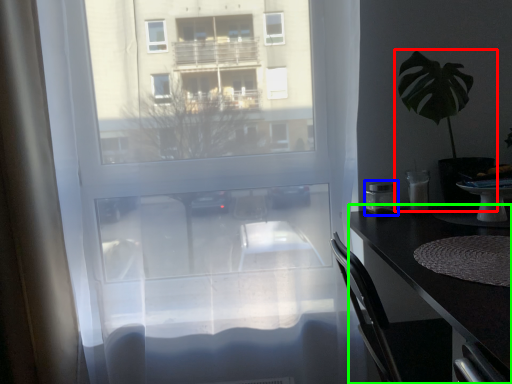
Question: Estimate the real-world distances between objects in this image. Which object is farther from houseplant (highlighted by a red box), appliance (highlighted by a blue box) or desk (highlighted by a green box)?

Choices:
 (A) appliance
 (B) desk

Answer: (B)